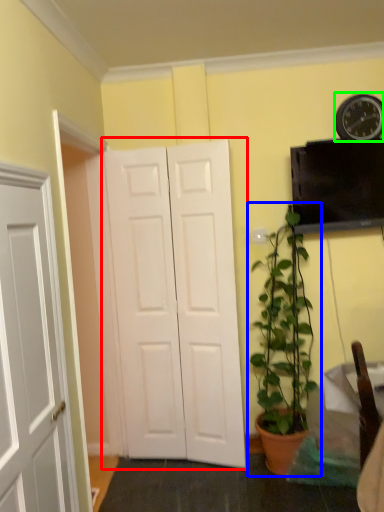
Question: Considering the real-world distances, which object is closest to door (highlighted by a red box)? houseplant (highlighted by a blue box) or clock (highlighted by a green box).

Choices:
 (A) houseplant
 (B) clock

Answer: (A)